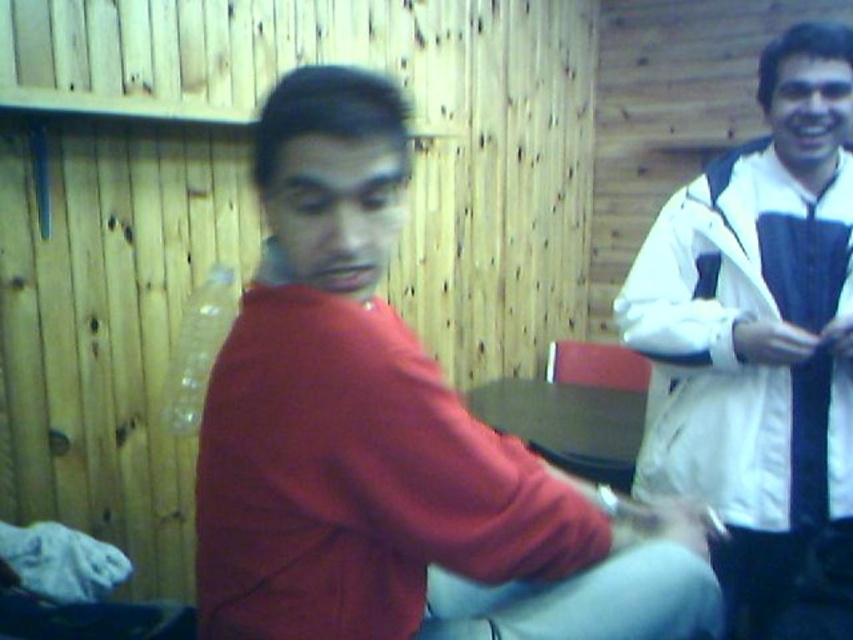
You are a photographer standing in front of the two people in the image. You want to take a photo that includes both the matte red shirt at center and the white matte jacket at upper right. Given the distance between them, will you need to zoom out your camera lens to ensure both subjects are fully visible in the frame?

The distance between the matte red shirt at center and the white matte jacket at upper right is 27.22 inches. To capture both subjects in the same frame, you would need to zoom out your camera lens to accommodate the space between them.

You are a photographer setting up for a portrait. You notice the matte red shirt at center and the black silk tie at right in your frame. Which object should you adjust your camera to focus on if you want to capture the subject on the right side of the frame?

The black silk tie at right is on the right side of the frame, so you should focus on the black silk tie at right to capture the subject on the right side of the frame.

Looking at this image, you are a photographer setting up for a group photo. You notice the matte red shirt at center and the white matte jacket at upper right. Which object should you position closer to the camera to ensure both are in focus, considering their current positions?

You should position the matte red shirt at center closer to the camera because it is to the left of the white matte jacket at upper right, so moving it forward will help both remain in focus.